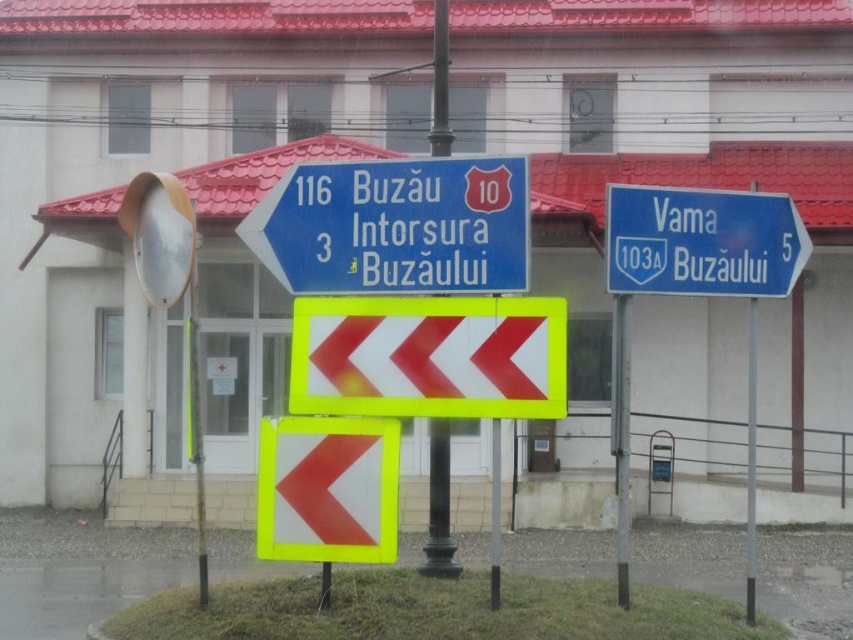
You are a delivery driver approaching the intersection and need to decide which direction to turn. You see the blue plastic sign at upper right and the metallic pole at center. Which object is positioned more to the right side of your view?

The blue plastic sign at upper right is positioned more to the right side of your view than the metallic pole at center because it is to the right of it.

You are driving on a road and see the blue plastic road sign at upper left and the yellow reflective arrow at center. Which one is positioned more to the right from your perspective?

The blue plastic road sign at upper left is positioned to the right of the yellow reflective arrow at center, so it is more to the right.

You are a delivery driver who needs to follow the route indicated by the blue plastic sign at upper right. According to the image, where exactly is this sign positioned relative to the other objects in the scene?

The blue plastic sign at upper right is located at point (701,241), which places it in the upper right area of the scene, making it easily visible for drivers needing to follow the route indicated by this sign.